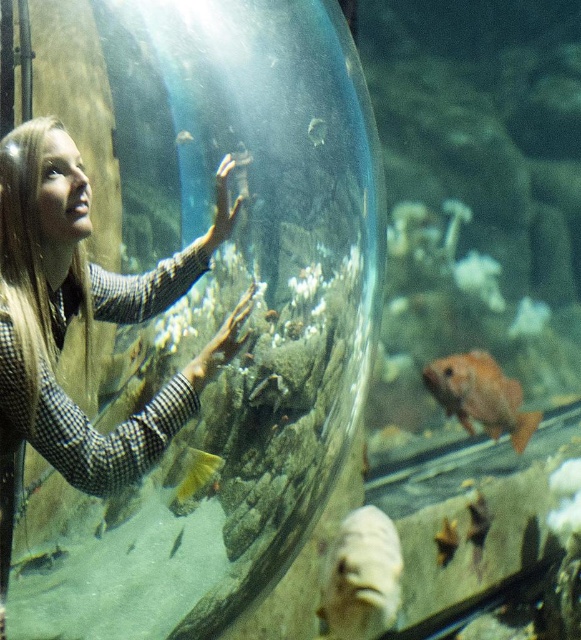
You are a robotic fish in the aquarium. You want to swim to the left side of the tank to meet the person. Which direction should you swim relative to the blonde hair at left?

Since the blonde hair at left is already on the left side of the tank, you should swim towards the center or stay near the blonde hair at left to meet the person.

You are a marine biologist observing the aquarium. You notice the translucent glass fish at center and the smooth gray rock at center. Which object is closer to the front of the tank?

The translucent glass fish at center is positioned over the smooth gray rock at center, so it is closer to the front of the tank.